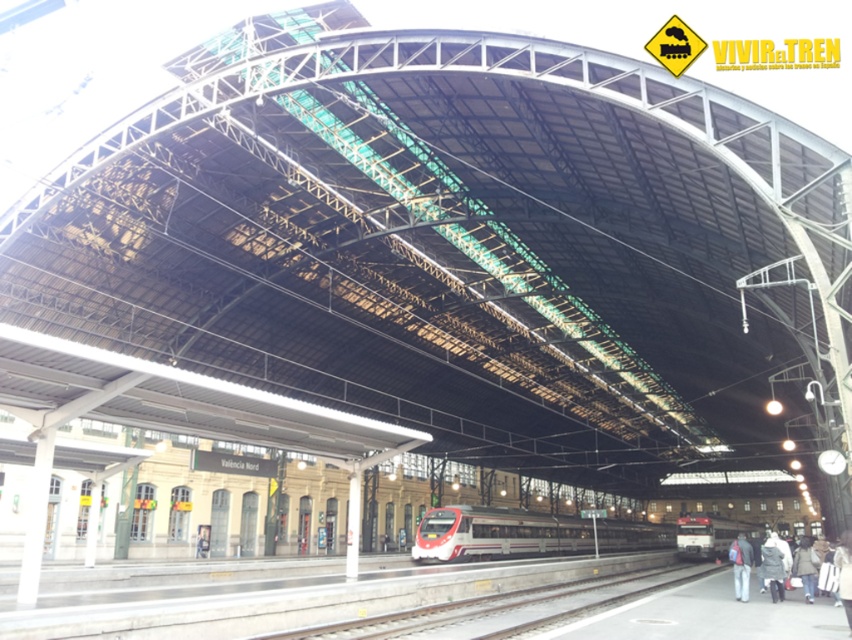
You are a maintenance worker needing to inspect the smooth concrete train track at center and the white glossy train at center. Which object is shorter in length?

The smooth concrete train track at center is shorter than the white glossy train at center.

You are a passenger waiting at the train station. You see the smooth concrete train track at center and the white fuzzy coat at lower right. Which object is closer to you?

The smooth concrete train track at center is closer to you because it is in front of the white fuzzy coat at lower right.